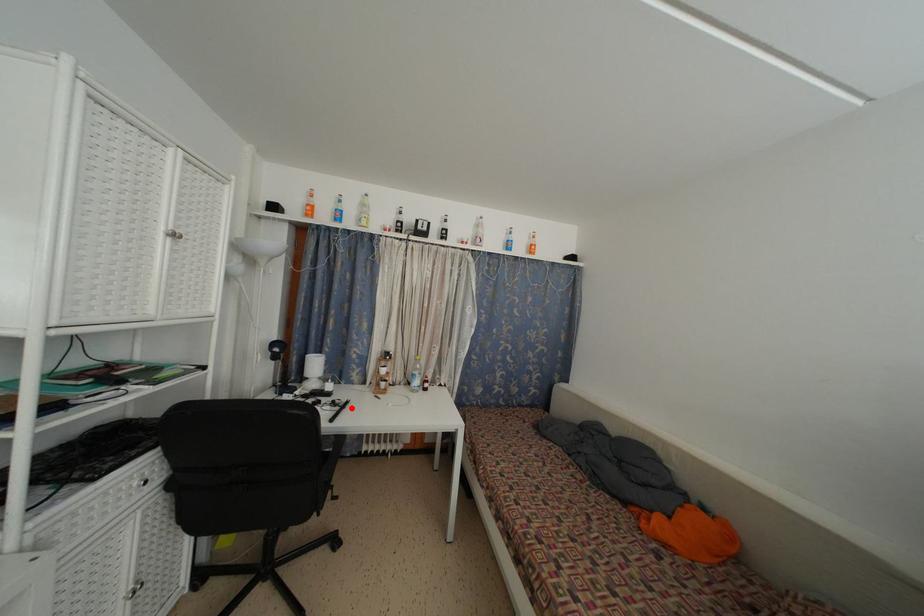
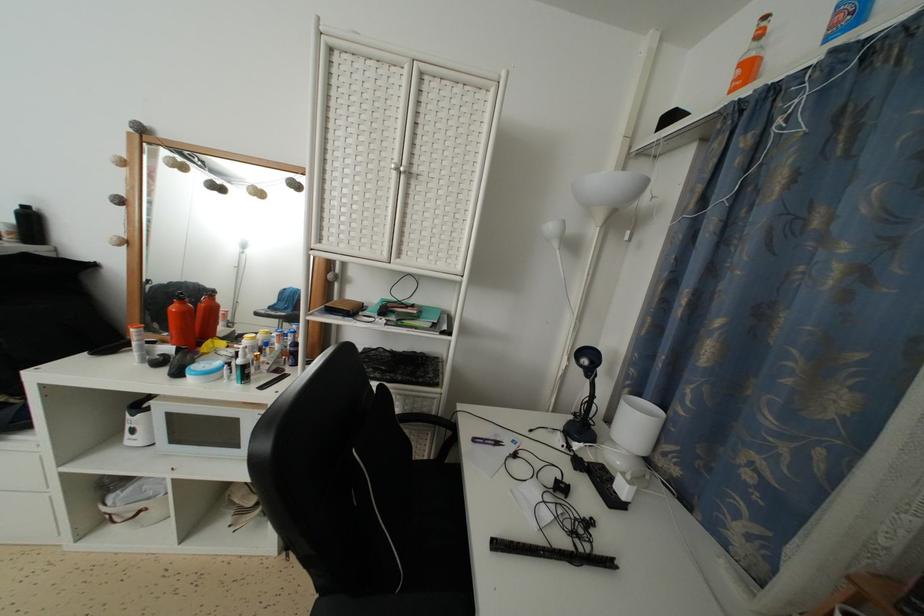
In the second image, find the point that corresponds to the highlighted location in the first image.

(614, 569)